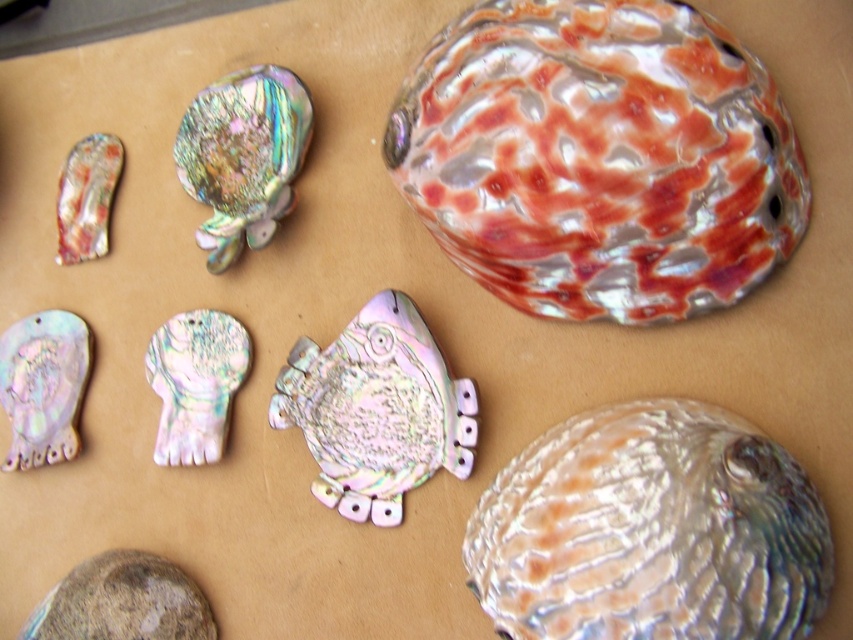
Between iridescent glossy shell at lower right and iridescent pearl shell at lower left, which one is positioned lower?

iridescent glossy shell at lower right is lower down.

Does iridescent glossy shell at lower right have a lesser width compared to iridescent pearl shell at lower left?

Incorrect, iridescent glossy shell at lower right's width is not less than iridescent pearl shell at lower left's.

Describe the element at coordinates (650, 531) in the screenshot. The width and height of the screenshot is (853, 640). I see `iridescent glossy shell at lower right` at that location.

You are a GUI agent. You are given a task and a screenshot of the screen. Output one action in this format:
    pyautogui.click(x=<x>, y=<y>)
    Task: Click on the iridescent glossy shell at lower right
    The width and height of the screenshot is (853, 640).
    Given the screenshot: What is the action you would take?
    pyautogui.click(x=650, y=531)

Does multicolored iridescent shell at upper right have a larger size compared to iridescent shell at upper left?

Yes.

Between point (525, 22) and point (263, 68), which one is positioned behind?

The point (263, 68) is more distant.

At what (x,y) coordinates should I click in order to perform the action: click on multicolored iridescent shell at upper right. Please return your answer as a coordinate pair (x, y). This screenshot has width=853, height=640. Looking at the image, I should click on (599, 157).

Between multicolored iridescent shell at upper right and iridescent glossy shell at lower right, which one has less height?

iridescent glossy shell at lower right

Is point (595, 316) positioned behind point (747, 426)?

Yes.

This screenshot has width=853, height=640. What are the coordinates of `multicolored iridescent shell at upper right` in the screenshot? It's located at (599, 157).